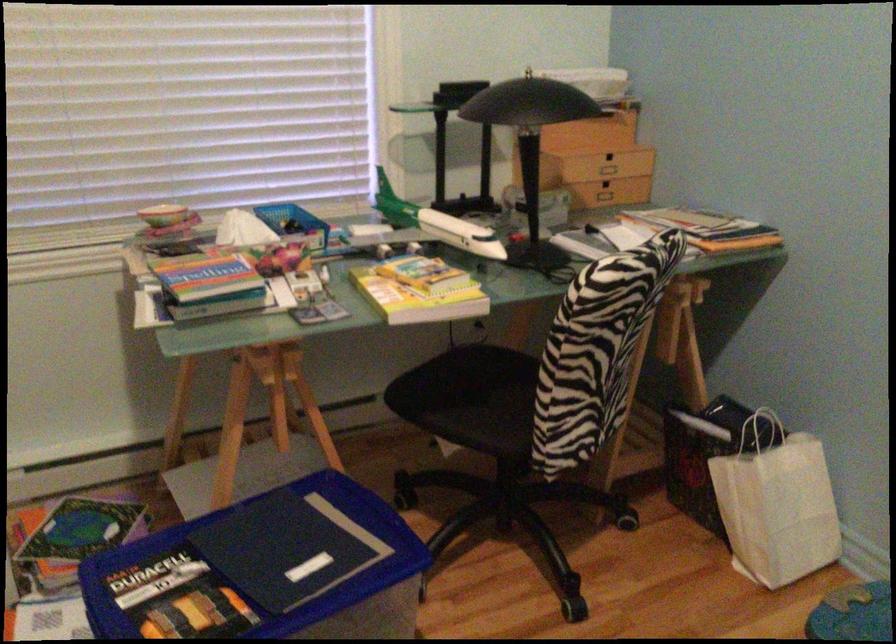
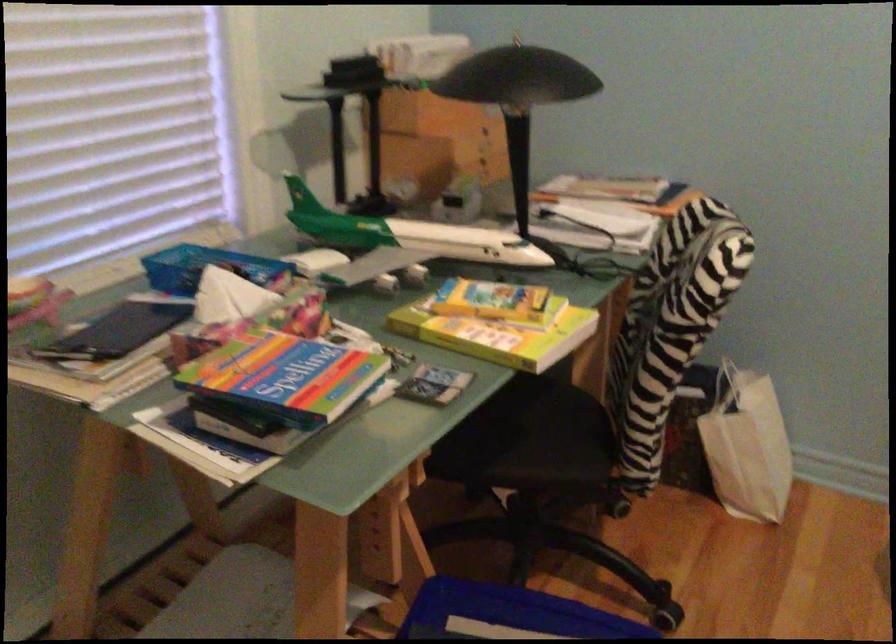
In the second image, find the point that corresponds to (x=202, y=276) in the first image.

(285, 377)